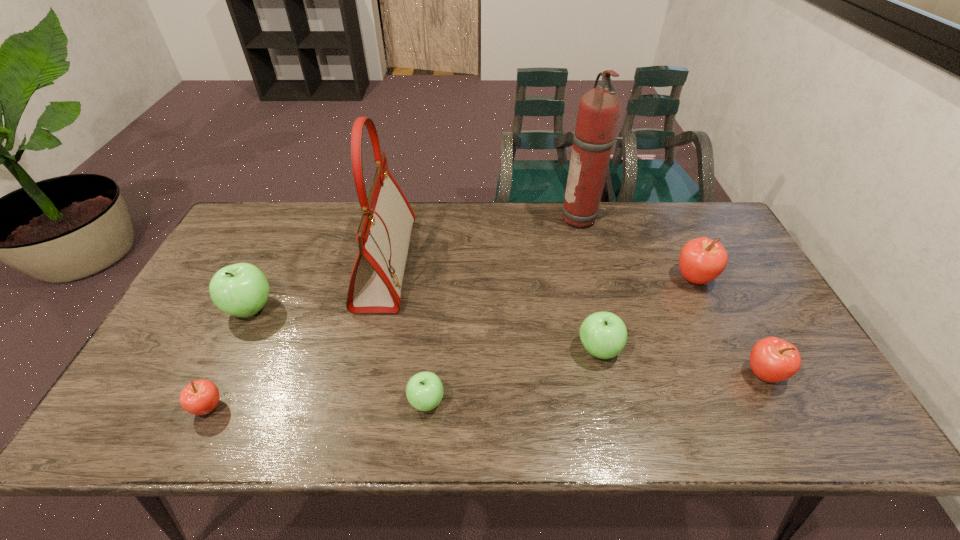
Locate an element on the screen. The height and width of the screenshot is (540, 960). free location located on the left of the second biggest pink apple is located at coordinates pyautogui.click(x=698, y=374).

Where is `free space located 0.210m on the back of the nearest pink apple`? free space located 0.210m on the back of the nearest pink apple is located at coordinates (249, 323).

You are a GUI agent. You are given a task and a screenshot of the screen. Output one action in this format:
    pyautogui.click(x=<x>, y=<y>)
    Task: Click on the free location located on the back of the nearest green apple
    Image resolution: width=960 pixels, height=540 pixels.
    Given the screenshot: What is the action you would take?
    pyautogui.click(x=438, y=283)

The width and height of the screenshot is (960, 540). Find the location of `fire extinguisher that is positioned at the far edge`. fire extinguisher that is positioned at the far edge is located at coordinates (599, 109).

The width and height of the screenshot is (960, 540). Find the location of `handbag that is at the far edge`. handbag that is at the far edge is located at coordinates (383, 234).

Identify the location of object at the near left corner. This screenshot has height=540, width=960. (200, 397).

In the image, there is a desktop. What are the coordinates of `vacant region at the far edge` in the screenshot? It's located at (424, 245).

Identify the location of free space at the near edge. (482, 429).

Find the location of `vacant region at the left edge of the desktop`. vacant region at the left edge of the desktop is located at coordinates (206, 355).

In the image, there is a desktop. Where is `vacant region at the far left corner`? Image resolution: width=960 pixels, height=540 pixels. vacant region at the far left corner is located at coordinates (237, 233).